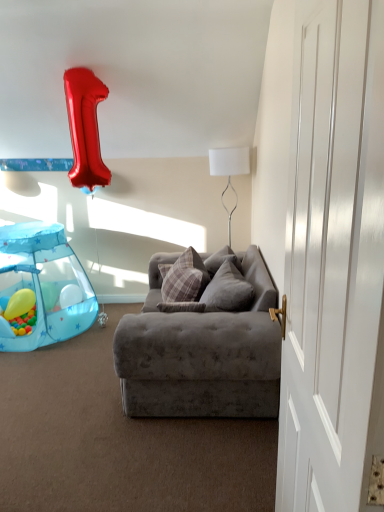
This screenshot has width=384, height=512. What do you see at coordinates (201, 354) in the screenshot?
I see `velvet gray couch at center` at bounding box center [201, 354].

The image size is (384, 512). I want to click on yellow rubber balloon at lower left, so click(20, 303).

This screenshot has height=512, width=384. What do you see at coordinates (334, 264) in the screenshot?
I see `white smooth door at right` at bounding box center [334, 264].

You are a GUI agent. You are given a task and a screenshot of the screen. Output one action in this format:
    pyautogui.click(x=<x>, y=<y>)
    Task: Click on the white fabric lampshade at upper center
    This screenshot has height=512, width=384.
    Given the screenshot: What is the action you would take?
    pos(229,170)

Measure the distance between plush gray pillow at center, arranged as the first pillow when viewed from the right, and camera.

plush gray pillow at center, arranged as the first pillow when viewed from the right, and camera are 8.39 feet apart from each other.

Measure the distance between point (237, 278) and camera.

The distance of point (237, 278) from camera is 2.71 meters.

What do you see at coordinates (185, 279) in the screenshot? I see `plaid fabric pillow at center, which appears as the first pillow when viewed from the left` at bounding box center [185, 279].

This screenshot has width=384, height=512. What are the coordinates of `blue fabric playpen at lower left` in the screenshot? It's located at (44, 285).

Considering the sizes of objects plaid fabric pillow at center, which is counted as the 2th pillow, starting from the right, and white fabric lampshade at upper center in the image provided, who is wider, plaid fabric pillow at center, which is counted as the 2th pillow, starting from the right, or white fabric lampshade at upper center?

Wider between the two is white fabric lampshade at upper center.

Are plaid fabric pillow at center, which is counted as the 2th pillow, starting from the right, and white fabric lampshade at upper center making contact?

plaid fabric pillow at center, which is counted as the 2th pillow, starting from the right, and white fabric lampshade at upper center are not in contact.

How far apart are plaid fabric pillow at center, which appears as the first pillow when viewed from the left, and white fabric lampshade at upper center?

plaid fabric pillow at center, which appears as the first pillow when viewed from the left, is 3.39 feet from white fabric lampshade at upper center.

At what (x,y) coordinates should I click in order to perform the action: click on lamp to the right of plaid fabric pillow at center, which appears as the first pillow when viewed from the left. Please return your answer as a coordinate pair (x, y). This screenshot has width=384, height=512. Looking at the image, I should click on (229, 170).

Is point (24, 306) positioned in front of point (39, 305)?

No.

From a real-world perspective, is yellow rubber balloon at lower left positioned above or below blue fabric playpen at lower left?

From a real-world perspective, yellow rubber balloon at lower left is physically below blue fabric playpen at lower left.

Is yellow rubber balloon at lower left inside or outside of blue fabric playpen at lower left?

yellow rubber balloon at lower left is inside blue fabric playpen at lower left.

Looking at this image, is yellow rubber balloon at lower left bigger than velvet gray couch at center?

Incorrect, yellow rubber balloon at lower left is not larger than velvet gray couch at center.

Is yellow rubber balloon at lower left inside or outside of velvet gray couch at center?

yellow rubber balloon at lower left cannot be found inside velvet gray couch at center.

Between point (22, 289) and point (143, 306), which one is positioned behind?

Positioned behind is point (22, 289).

Identify the location of lamp that appears above the blue fabric playpen at lower left (from a real-world perspective). The height and width of the screenshot is (512, 384). (229, 170).

Does white fabric lampshade at upper center touch blue fabric playpen at lower left?

No, white fabric lampshade at upper center is not with blue fabric playpen at lower left.

Can you confirm if white fabric lampshade at upper center is positioned to the right of blue fabric playpen at lower left?

Indeed, white fabric lampshade at upper center is positioned on the right side of blue fabric playpen at lower left.

From the image's perspective, relative to plaid fabric pillow at center, which is counted as the 2th pillow, starting from the right, is yellow rubber balloon at lower left above or below?

yellow rubber balloon at lower left is below plaid fabric pillow at center, which is counted as the 2th pillow, starting from the right.

From a real-world perspective, is yellow rubber balloon at lower left on plaid fabric pillow at center, which is counted as the 2th pillow, starting from the right?

Incorrect, from a real-world perspective, yellow rubber balloon at lower left is lower than plaid fabric pillow at center, which is counted as the 2th pillow, starting from the right.

Is yellow rubber balloon at lower left to the left or to the right of plaid fabric pillow at center, which appears as the first pillow when viewed from the left, in the image?

Clearly, yellow rubber balloon at lower left is on the left of plaid fabric pillow at center, which appears as the first pillow when viewed from the left, in the image.

Considering the points (18, 304) and (189, 252), which point is behind, point (18, 304) or point (189, 252)?

The point (18, 304) is behind.

Is velvet gray couch at center looking in the opposite direction of plaid fabric pillow at center, which is counted as the 2th pillow, starting from the right?

Yes, velvet gray couch at center's orientation is away from plaid fabric pillow at center, which is counted as the 2th pillow, starting from the right.

How different are the orientations of velvet gray couch at center and plaid fabric pillow at center, which is counted as the 2th pillow, starting from the right, in degrees?

3.6 degrees separate the facing orientations of velvet gray couch at center and plaid fabric pillow at center, which is counted as the 2th pillow, starting from the right.

Measure the distance between velvet gray couch at center and plaid fabric pillow at center, which appears as the first pillow when viewed from the left.

velvet gray couch at center and plaid fabric pillow at center, which appears as the first pillow when viewed from the left, are 19.31 inches apart.

In the scene shown: From a real-world perspective, is velvet gray couch at center positioned under plaid fabric pillow at center, which is counted as the 2th pillow, starting from the right, based on gravity?

Yes.

Could you tell me if yellow rubber balloon at lower left is turned towards white smooth door at right?

No, yellow rubber balloon at lower left does not turn towards white smooth door at right.

Between yellow rubber balloon at lower left and white smooth door at right, which one has less height?

Standing shorter between the two is yellow rubber balloon at lower left.

From a real-world perspective, is yellow rubber balloon at lower left over white smooth door at right?

No.

From the image's perspective, between yellow rubber balloon at lower left and white smooth door at right, who is located below?

yellow rubber balloon at lower left is shown below in the image.

There is a white fabric lampshade at upper center. Identify the location of the 1st pillow below it (from the image's perspective). (185, 279).

Image resolution: width=384 pixels, height=512 pixels. What are the coordinates of `balloon on the left side of blue fabric playpen at lower left` in the screenshot? It's located at (20, 303).

Based on their spatial positions, is plaid fabric pillow at center, which is counted as the 2th pillow, starting from the right, or plush gray pillow at center, arranged as the first pillow when viewed from the right, closer to white smooth door at right?

plush gray pillow at center, arranged as the first pillow when viewed from the right, is closer to white smooth door at right.

Based on their spatial positions, is plush gray pillow at center, arranged as the first pillow when viewed from the right, or blue fabric playpen at lower left closer to white fabric lampshade at upper center?

Based on the image, plush gray pillow at center, arranged as the first pillow when viewed from the right, appears to be nearer to white fabric lampshade at upper center.

Which object lies nearer to the anchor point velvet gray couch at center, white fabric lampshade at upper center or plaid fabric pillow at center, which is counted as the 2th pillow, starting from the right?

plaid fabric pillow at center, which is counted as the 2th pillow, starting from the right, is positioned closer to the anchor velvet gray couch at center.

Considering their positions, is white fabric lampshade at upper center positioned further to plaid fabric pillow at center, which is counted as the 2th pillow, starting from the right, than plush gray pillow at center, arranged as the first pillow when viewed from the right?

white fabric lampshade at upper center lies further to plaid fabric pillow at center, which is counted as the 2th pillow, starting from the right, than the other object.

Estimate the real-world distances between objects in this image. Which object is further from white fabric lampshade at upper center, velvet gray couch at center or blue fabric playpen at lower left?

blue fabric playpen at lower left lies further to white fabric lampshade at upper center than the other object.

Looking at the image, which one is located further to yellow rubber balloon at lower left, white fabric lampshade at upper center or velvet gray couch at center?

Among the two, white fabric lampshade at upper center is located further to yellow rubber balloon at lower left.

Which object lies nearer to the anchor point blue fabric playpen at lower left, yellow rubber balloon at lower left or white smooth door at right?

yellow rubber balloon at lower left is closer to blue fabric playpen at lower left.

Based on their spatial positions, is white smooth door at right or yellow rubber balloon at lower left further from plush gray pillow at center, arranged as the first pillow when viewed from the right?

yellow rubber balloon at lower left.

Locate an element on the screen. The width and height of the screenshot is (384, 512). pillow between yellow rubber balloon at lower left and plush gray pillow at center, arranged as the first pillow when viewed from the right, from left to right is located at coordinates (185, 279).

Where is `baby carriage between white smooth door at right and white fabric lampshade at upper center in the front-back direction`? baby carriage between white smooth door at right and white fabric lampshade at upper center in the front-back direction is located at coordinates (44, 285).

I want to click on baby carriage located between yellow rubber balloon at lower left and plush gray pillow at center, arranged as the first pillow when viewed from the right, in the left-right direction, so click(44, 285).

Identify the location of pillow between white smooth door at right and plaid fabric pillow at center, which is counted as the 2th pillow, starting from the right, from front to back. Image resolution: width=384 pixels, height=512 pixels. (228, 290).